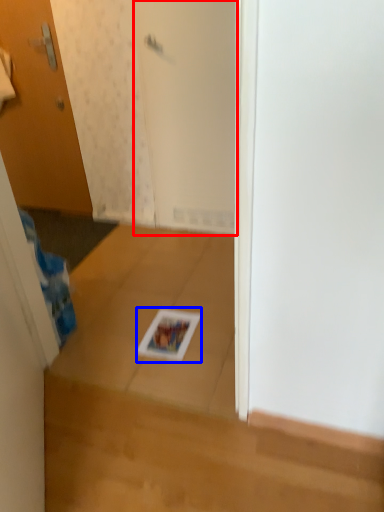
Question: Which object appears closest to the camera in this image, screen door (highlighted by a red box) or magazine (highlighted by a blue box)?

Choices:
 (A) screen door
 (B) magazine

Answer: (B)